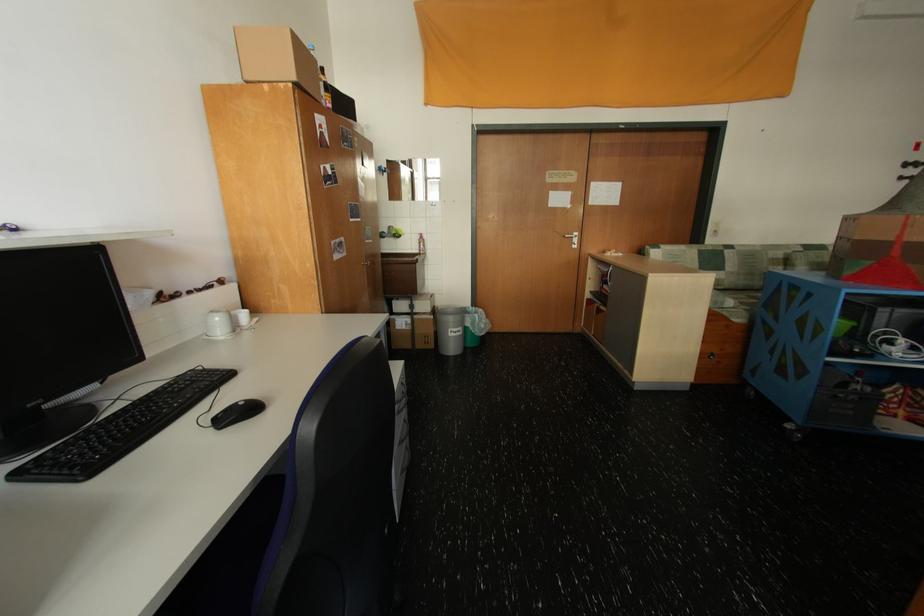
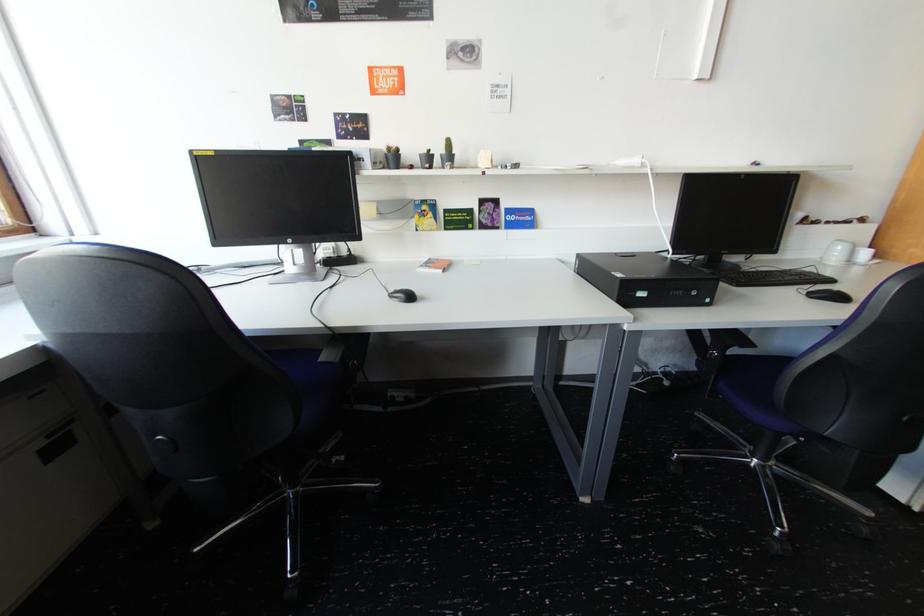
Where in the second image is the point corresponding to point 244,329 from the first image?

(859, 262)